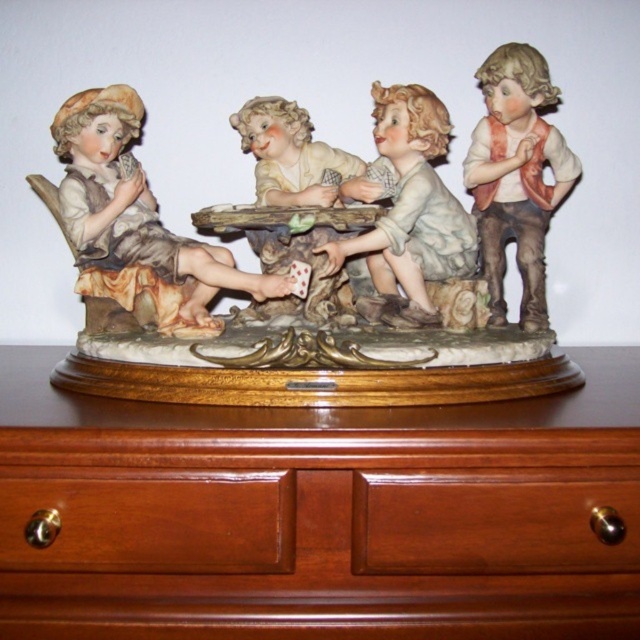
You are standing in front of a wooden cabinet and see the porcelain figurines at center and the porcelain doll at left. Which object is nearer to you?

The porcelain figurines at center are closer to the viewer than the porcelain doll at left.

Consider the image. You are standing 1 meter away from the decorative figurine. If you want to touch the point at coordinate point (352, 528) on the figurine, will you need to move closer?

The point at coordinate point (352, 528) is 73.53 centimeters away from the camera. Since you are currently 1 meter away, you need to move 26.47 centimeters closer to reach it.